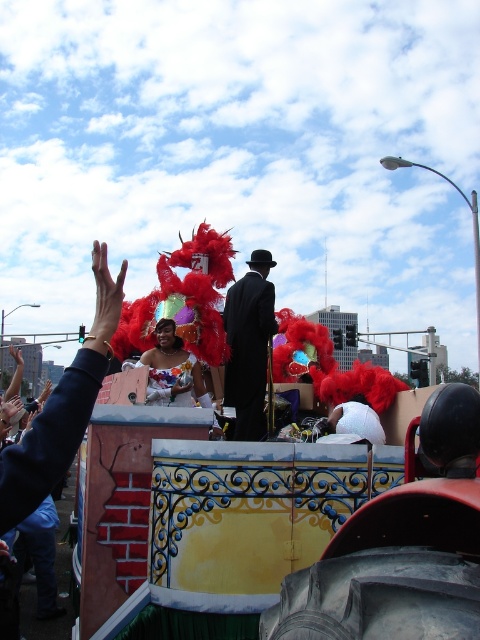
Is black satin suit at center bigger than matte white dress at center?

Indeed, black satin suit at center has a larger size compared to matte white dress at center.

Consider the image. How much distance is there between black satin suit at center and matte white dress at center?

A distance of 2.94 meters exists between black satin suit at center and matte white dress at center.

Is point (233, 330) farther from camera compared to point (159, 355)?

Yes, it is.

This screenshot has height=640, width=480. I want to click on black satin suit at center, so click(249, 344).